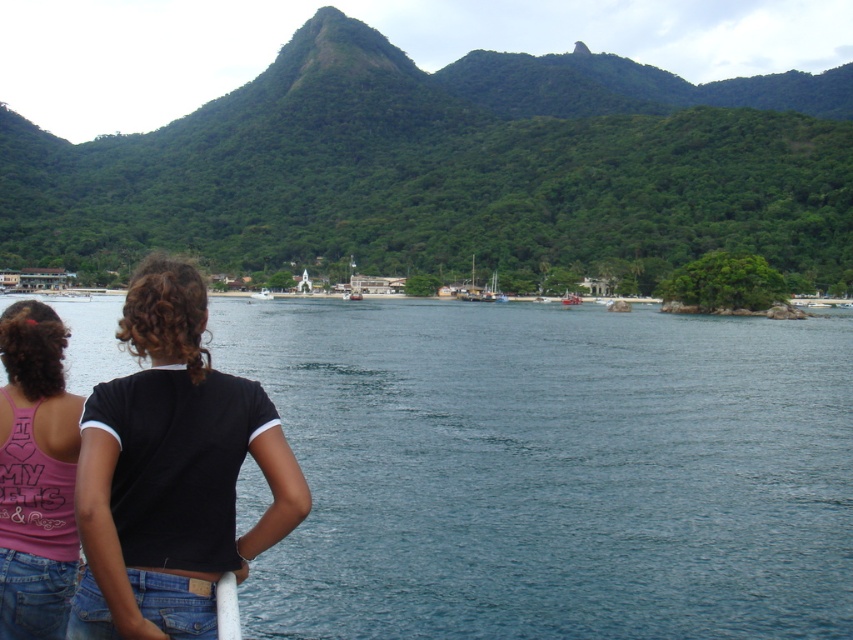
You are standing in the coastal scene and want to point to the exact location of the point marked at coordinates (451,168). Based on the description provided, where should you direct your gaze?

You should direct your gaze to the green leafy mountain at upper center, as the point marked at coordinates (451,168) is located there.

You are a photographer planning to take a wide shot of the scene. The green leafy mountain at upper center and the black matte shirt at left are both in your frame. Based on their sizes in the image, which object would occupy more of the frame?

The green leafy mountain at upper center would occupy more of the frame since its width is larger than the black matte shirt at left.

You are standing at the point closest to the camera in this coastal scene. Which point, point (733, 630) or point (199, 125), are you at?

You are at point (199, 125) because it is behind point (733, 630), which is closer to the camera.